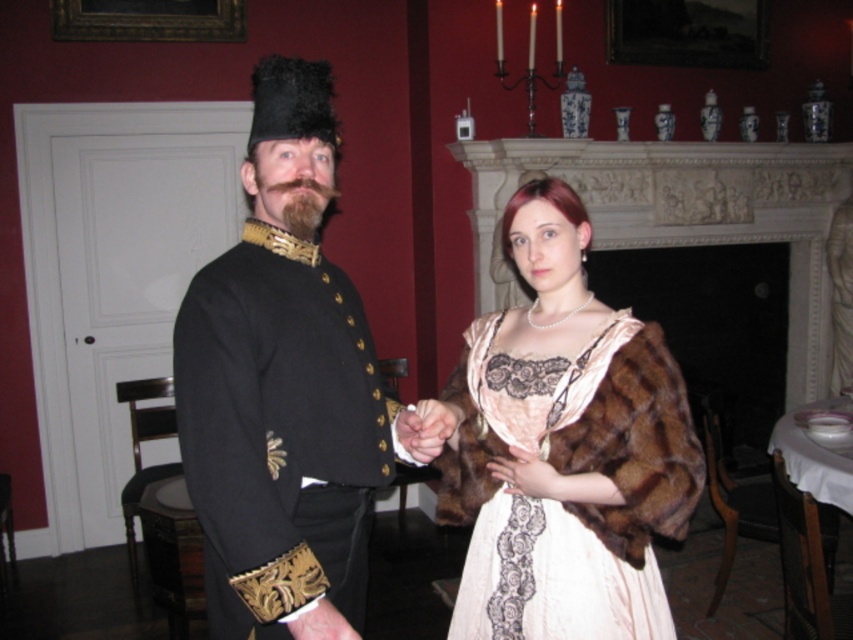
You are an artist trying to sketch this scene. You want to ensure the spatial relationship between the velvet black coat at left and the velvet beige dress with lace at center is accurate. Which one should you draw first to maintain the correct perspective?

The velvet black coat at left should be drawn first because it is closer to the viewer, so it should appear in front of the velvet beige dress with lace at center in the sketch.

You are an interior designer observing the scene. You need to place a decorative table between the velvet black coat at left and the velvet beige dress with lace at center. Based on their positions, where should the table be placed?

The velvet black coat at left is located above the velvet beige dress with lace at center, so the decorative table should be placed below the velvet black coat at left and above the velvet beige dress with lace at center to position it between them.

You are an artist trying to sketch the scene. You need to determine which of the two points, point (583, 378) or point (509, 484), is closer to you. Which one should you focus on first to ensure proper perspective?

Point (583, 378) is closer to the viewer than point (509, 484), so you should focus on point (583, 378) first to ensure proper perspective.